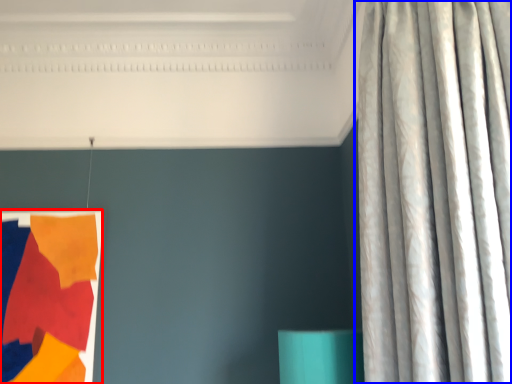
Question: Which object appears closest to the camera in this image, tapestry (highlighted by a red box) or curtain (highlighted by a blue box)?

Choices:
 (A) tapestry
 (B) curtain

Answer: (B)